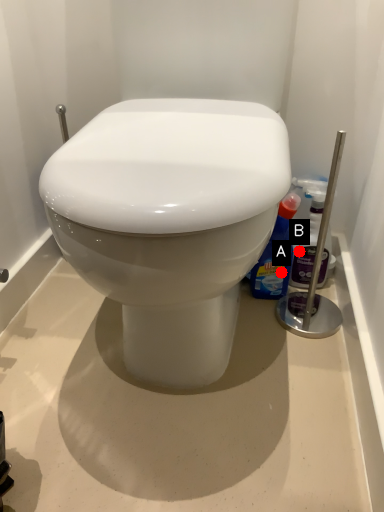
Question: Two points are circled on the image, labeled by A and B beside each circle. Which of the following is the farthest from the observer?

Choices:
 (A) A is further
 (B) B is further

Answer: (B)